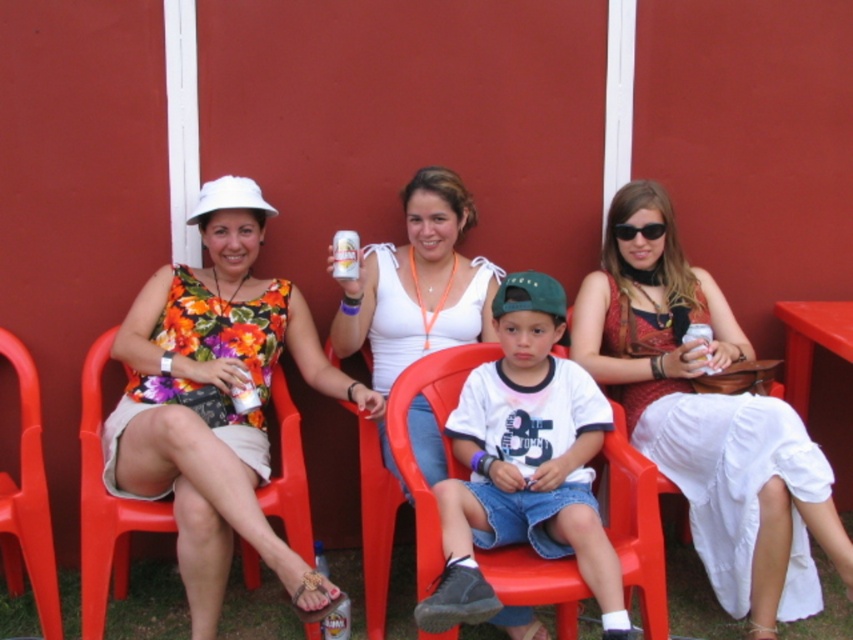
Question: Estimate the real-world distances between objects in this image. Which object is closer to the green fabric baseball cap at center?

Choices:
 (A) red plastic chair at left
 (B) black plastic sunglasses at upper center
 (C) matte red dress at center
 (D) metallic silver can at center

Answer: (D)

Question: Is matte plastic chair at left closer to the viewer compared to green fabric baseball cap at center?

Choices:
 (A) no
 (B) yes

Answer: (B)

Question: Does floral fabric top at left have a smaller size compared to white cotton shirt at center?

Choices:
 (A) yes
 (B) no

Answer: (B)

Question: Which of the following is the farthest from the observer?

Choices:
 (A) matte plastic chair at left
 (B) metallic silver can at center
 (C) green fabric baseball cap at center
 (D) white cotton shirt at center

Answer: (B)

Question: Which object is closer to the camera taking this photo?

Choices:
 (A) white cotton shirt at center
 (B) green fabric baseball cap at center

Answer: (A)

Question: Can you confirm if metallic silver can at center is positioned above black plastic sunglasses at upper center?

Choices:
 (A) yes
 (B) no

Answer: (B)